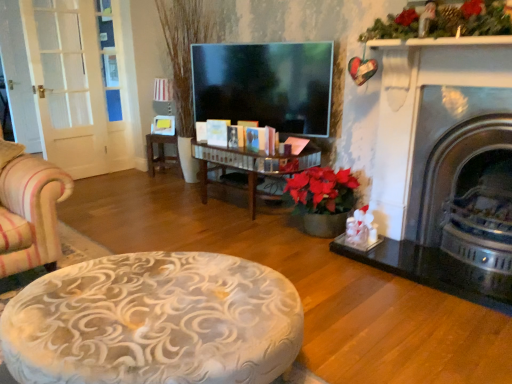
Question: Is shiny silver fireplace at right in front of wooden table at center?

Choices:
 (A) yes
 (B) no

Answer: (A)

Question: Are shiny silver fireplace at right and wooden table at center far apart?

Choices:
 (A) yes
 (B) no

Answer: (A)

Question: From the image's perspective, does shiny silver fireplace at right appear lower than wooden table at center?

Choices:
 (A) yes
 (B) no

Answer: (A)

Question: Does shiny silver fireplace at right have a smaller size compared to wooden table at center?

Choices:
 (A) yes
 (B) no

Answer: (B)

Question: Does shiny silver fireplace at right appear on the right side of wooden table at center?

Choices:
 (A) no
 (B) yes

Answer: (B)

Question: Is shiny silver fireplace at right to the left of wooden table at center from the viewer's perspective?

Choices:
 (A) no
 (B) yes

Answer: (A)

Question: From a real-world perspective, is wooden table at center positioned over shiny silver fireplace at right based on gravity?

Choices:
 (A) yes
 (B) no

Answer: (B)

Question: Is wooden table at center shorter than shiny silver fireplace at right?

Choices:
 (A) no
 (B) yes

Answer: (B)

Question: Is shiny silver fireplace at right a part of wooden table at center?

Choices:
 (A) yes
 (B) no

Answer: (B)

Question: From a real-world perspective, is wooden table at center below shiny silver fireplace at right?

Choices:
 (A) yes
 (B) no

Answer: (A)

Question: From the image's perspective, would you say wooden table at center is shown under shiny silver fireplace at right?

Choices:
 (A) no
 (B) yes

Answer: (A)

Question: Does wooden table at center come behind shiny silver fireplace at right?

Choices:
 (A) no
 (B) yes

Answer: (B)

Question: Looking at their shapes, would you say wooden table at center is wider or thinner than shiny silver fireplace at right?

Choices:
 (A) thin
 (B) wide

Answer: (A)